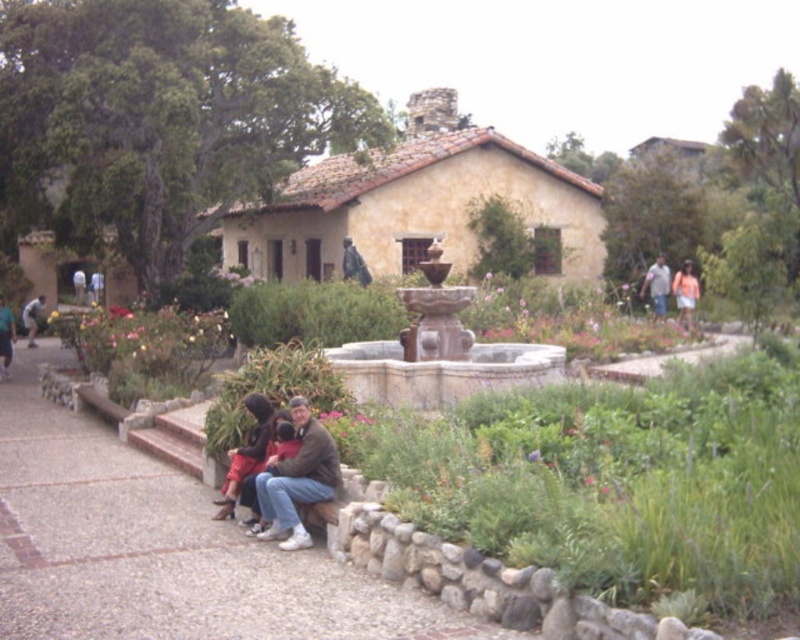
Question: Considering the real-world distances, which object is closest to the orange cotton shirt at right?

Choices:
 (A) smooth concrete bench at lower center
 (B) denim jacket at right
 (C) matte brown jacket at lower center

Answer: (B)

Question: Which of the following is the closest to the observer?

Choices:
 (A) matte black jacket at lower center
 (B) denim jacket at right

Answer: (A)

Question: Which object appears closest to the camera in this image?

Choices:
 (A) stone fountain at center
 (B) smooth concrete bench at lower center

Answer: (B)

Question: Does stone fountain at center appear on the left side of matte brown jacket at lower center?

Choices:
 (A) no
 (B) yes

Answer: (A)

Question: Does matte black jacket at lower center appear on the right side of denim jacket at right?

Choices:
 (A) no
 (B) yes

Answer: (A)

Question: Is matte black jacket at lower center to the right of matte brown jacket at lower center from the viewer's perspective?

Choices:
 (A) yes
 (B) no

Answer: (A)